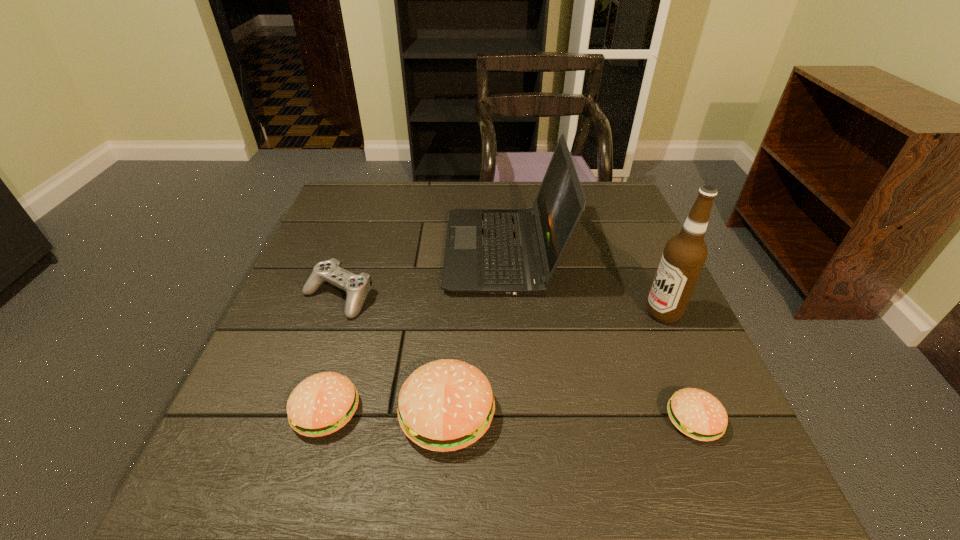
Find the location of a particular element. vacant space at the near right corner of the desktop is located at coordinates (657, 409).

Find the location of a particular element. free space between the control and the leftmost patty is located at coordinates (x=332, y=354).

This screenshot has height=540, width=960. I want to click on free spot between the third tallest object and the control, so click(x=393, y=355).

Find the location of a particular element. free space between the second tallest patty and the tallest patty is located at coordinates (387, 413).

You are a GUI agent. You are given a task and a screenshot of the screen. Output one action in this format:
    pyautogui.click(x=<x>, y=<y>)
    Task: Click on the empty space between the control and the shortest object
    The height and width of the screenshot is (540, 960).
    Given the screenshot: What is the action you would take?
    pyautogui.click(x=516, y=359)

You are a GUI agent. You are given a task and a screenshot of the screen. Output one action in this format:
    pyautogui.click(x=<x>, y=<y>)
    Task: Click on the blank region between the tallest patty and the shortest object
    
    Given the screenshot: What is the action you would take?
    570,417

You are a GUI agent. You are given a task and a screenshot of the screen. Output one action in this format:
    pyautogui.click(x=<x>, y=<y>)
    Task: Click on the free space between the second patty from right to left and the second shortest patty
    
    Given the screenshot: What is the action you would take?
    pyautogui.click(x=387, y=413)

The width and height of the screenshot is (960, 540). I want to click on free spot between the second tallest object and the rightmost patty, so click(x=598, y=336).

Find the location of `free space between the fourth shortest object and the rightmost patty`. free space between the fourth shortest object and the rightmost patty is located at coordinates (570, 417).

Identify the location of vacant point located between the alcohol and the second tallest object. This screenshot has width=960, height=540. (583, 282).